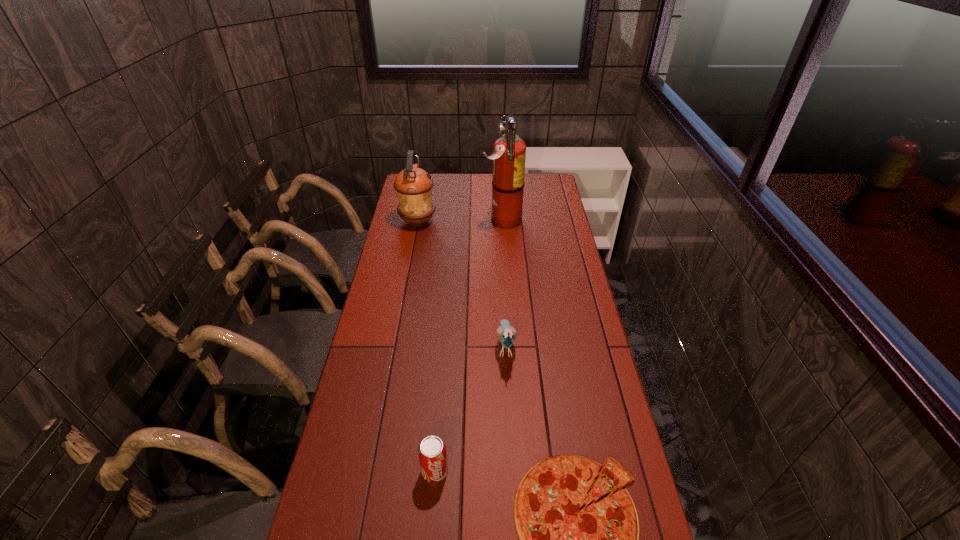
This screenshot has height=540, width=960. Identify the location of free space located 0.360m on the back of the oil lamp. [x=426, y=176].

Find the location of a particular element. free location located at the face of the third shortest object is located at coordinates (509, 409).

At what (x,y) coordinates should I click in order to perform the action: click on blank space located on the back of the fourth tallest object. Please return your answer as a coordinate pair (x, y). This screenshot has width=960, height=540. Looking at the image, I should click on (442, 384).

This screenshot has width=960, height=540. Find the location of `object positioned at the left edge`. object positioned at the left edge is located at coordinates (413, 185).

Locate an element on the screen. Image resolution: width=960 pixels, height=540 pixels. vacant area at the far edge of the desktop is located at coordinates (468, 181).

What are the coordinates of `vacant space at the left edge` in the screenshot? It's located at (414, 250).

At what (x,y) coordinates should I click in order to perform the action: click on vacant space at the right edge of the desktop. Please return your answer as a coordinate pair (x, y). Looking at the image, I should click on (559, 293).

In the image, there is a desktop. Find the location of `free space at the far right corner`. free space at the far right corner is located at coordinates (547, 194).

Locate an element on the screen. free spot between the third farthest object and the second object from left to right is located at coordinates (470, 408).

This screenshot has height=540, width=960. Identify the location of vacant point located between the leftmost object and the tallest object. (460, 221).